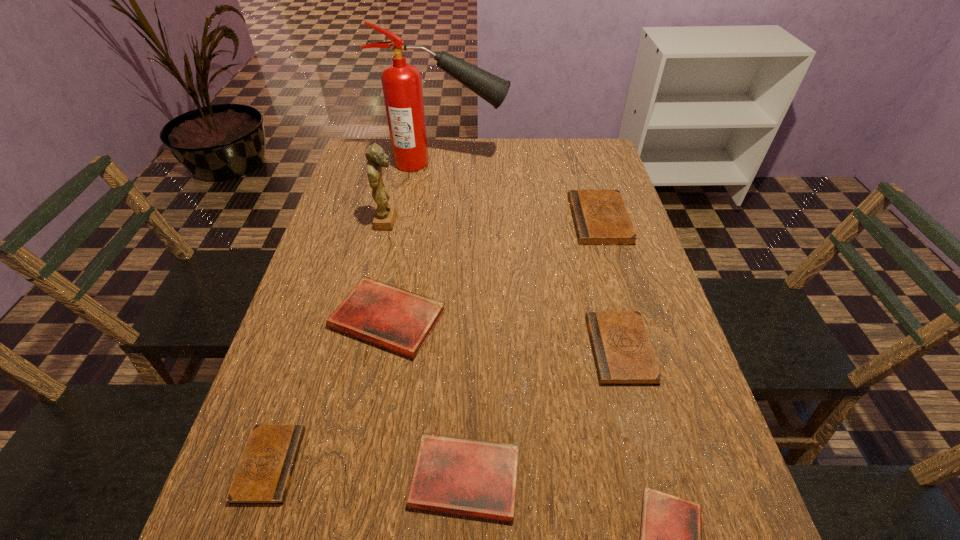
Where is `red fire extinguisher`? The width and height of the screenshot is (960, 540). red fire extinguisher is located at coordinates pos(402,86).

At what (x,y) coordinates should I click in order to perform the action: click on the farthest object. Please return your answer as a coordinate pair (x, y). The height and width of the screenshot is (540, 960). Looking at the image, I should click on (402, 86).

Where is `figurine`? Image resolution: width=960 pixels, height=540 pixels. figurine is located at coordinates (385, 215).

In order to click on the farthest diary in this screenshot , I will do `click(600, 217)`.

Where is `the third tallest object`? the third tallest object is located at coordinates [x=600, y=217].

Where is `the farthest red diary`? the farthest red diary is located at coordinates (385, 315).

At what (x,y) coordinates should I click in order to perform the action: click on the second nearest brown diary. Please return your answer as a coordinate pair (x, y). The width and height of the screenshot is (960, 540). Looking at the image, I should click on (623, 355).

At what (x,y) coordinates should I click in order to perform the action: click on the second smallest red diary. Please return your answer as a coordinate pair (x, y). Looking at the image, I should click on (476, 478).

Locate an element on the screen. The width and height of the screenshot is (960, 540). the leftmost brown diary is located at coordinates (263, 477).

The image size is (960, 540). What are the coordinates of `the smallest brown diary` in the screenshot? It's located at (x=263, y=477).